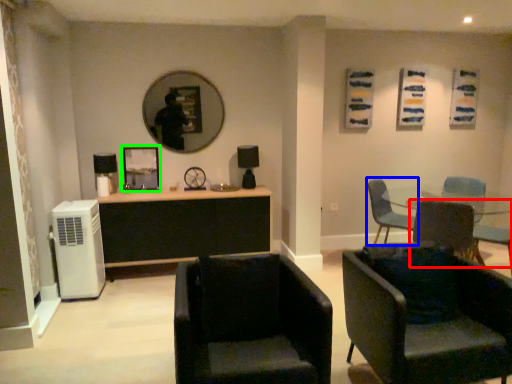
Question: Estimate the real-world distances between objects in this image. Which object is closer to chair (highlighted by a red box), chair (highlighted by a blue box) or picture frame (highlighted by a green box)?

Choices:
 (A) chair
 (B) picture frame

Answer: (A)